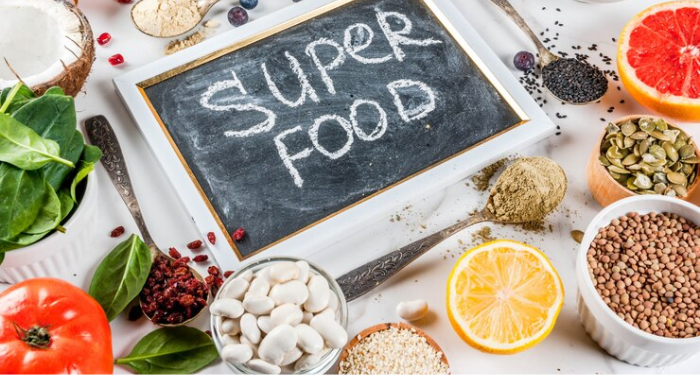
Locate an element on the screen. pot is located at coordinates (73, 239).